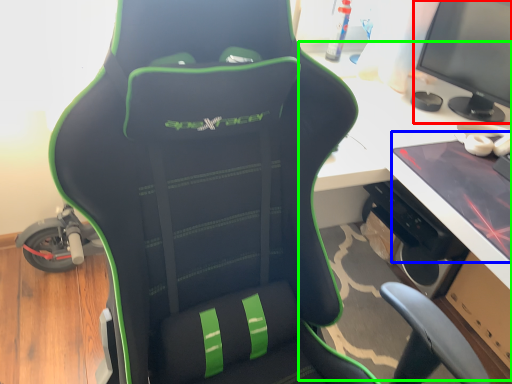
Question: Based on their relative distances, which object is farther from computer monitor (highlighted by a red box)? Choose from laptop (highlighted by a blue box) and computer desk (highlighted by a green box).

Choices:
 (A) laptop
 (B) computer desk

Answer: (A)